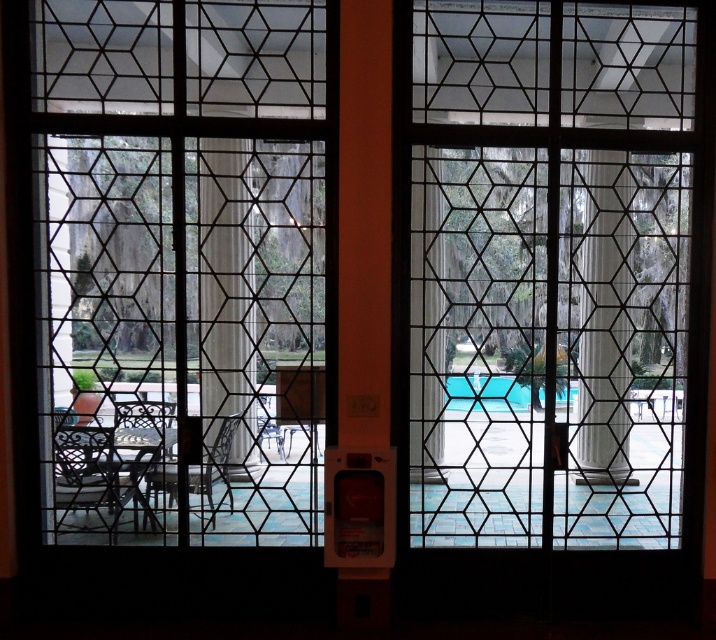
Consider the image. You are standing in front of the double doors and want to locate the clear glass window at center. Where exactly is it positioned in terms of coordinates?

The clear glass window at center is positioned at coordinates [180,264].

You are planning to install a new decorative sticker on the clear glass window at center and the blue glossy pool at center. Since you want the sticker on the window to be more prominent, which object should you choose to place the larger sticker on?

The clear glass window at center is larger in size than the blue glossy pool at center, so placing a larger sticker on the clear glass window at center will make it more prominent.